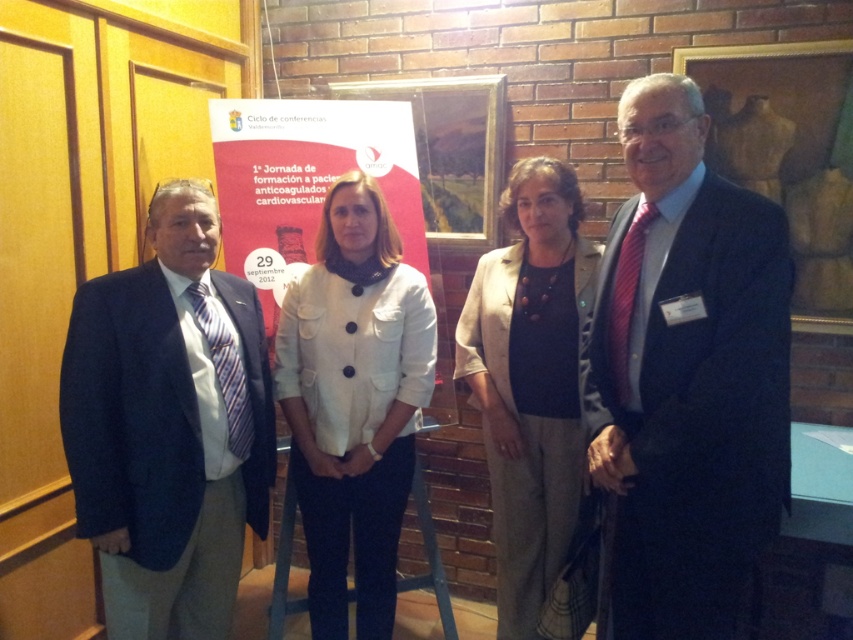
You are standing in front of the brick wall at the formal event. You notice two points marked at coordinates point (366, 564) and point (372, 152). Which point is closer to you?

Point (366, 564) is in front of point (372, 152), so it is closer to you.

You are a photographer at a formal event. You need to capture a photo of the white matte jacket at center and the beige textured blazer at center. The camera you are using has a minimum focus distance of 16 inches. Will you be able to focus on both subjects clearly without moving the camera?

The white matte jacket at center and beige textured blazer at center are 15.50 inches apart. Since the distance between them is less than the camera minimum focus distance of 16 inches, the camera may not be able to focus on both subjects clearly without moving closer or adjusting the settings.